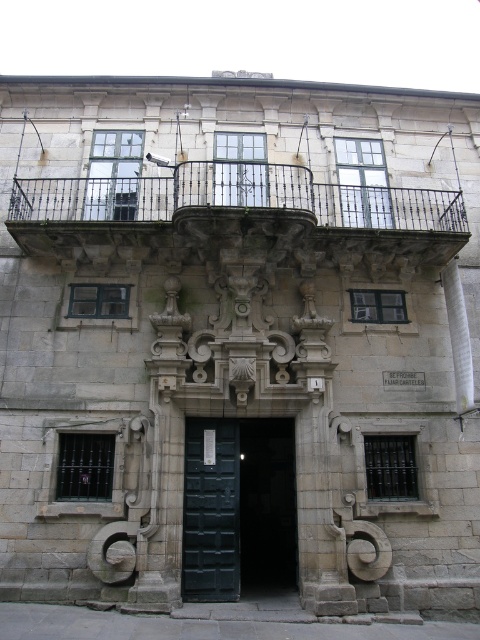
Is black wrought iron balcony at upper center shorter than green wooden door at center?

Correct, black wrought iron balcony at upper center is not as tall as green wooden door at center.

Consider the image. Who is positioned more to the right, black wrought iron balcony at upper center or green wooden door at center?

From the viewer's perspective, black wrought iron balcony at upper center appears more on the right side.

The image size is (480, 640). Find the location of `black wrought iron balcony at upper center`. black wrought iron balcony at upper center is located at coordinates (236, 212).

Image resolution: width=480 pixels, height=640 pixels. In order to click on black wrought iron balcony at upper center in this screenshot , I will do tap(236, 212).

Between green wooden door at center and dark green wooden door at center, which one appears on the right side from the viewer's perspective?

green wooden door at center is more to the right.

Is point (276, 461) positioned behind point (229, 488)?

Yes, it is behind point (229, 488).

Identify the location of green wooden door at center. (239, 508).

Does black wrought iron balcony at upper center have a greater width compared to dark green wooden door at center?

No, black wrought iron balcony at upper center is not wider than dark green wooden door at center.

Who is positioned more to the left, black wrought iron balcony at upper center or dark green wooden door at center?

Positioned to the left is dark green wooden door at center.

I want to click on black wrought iron balcony at upper center, so click(x=236, y=212).

Locate an element on the screen. Image resolution: width=480 pixels, height=640 pixels. black wrought iron balcony at upper center is located at coordinates (236, 212).